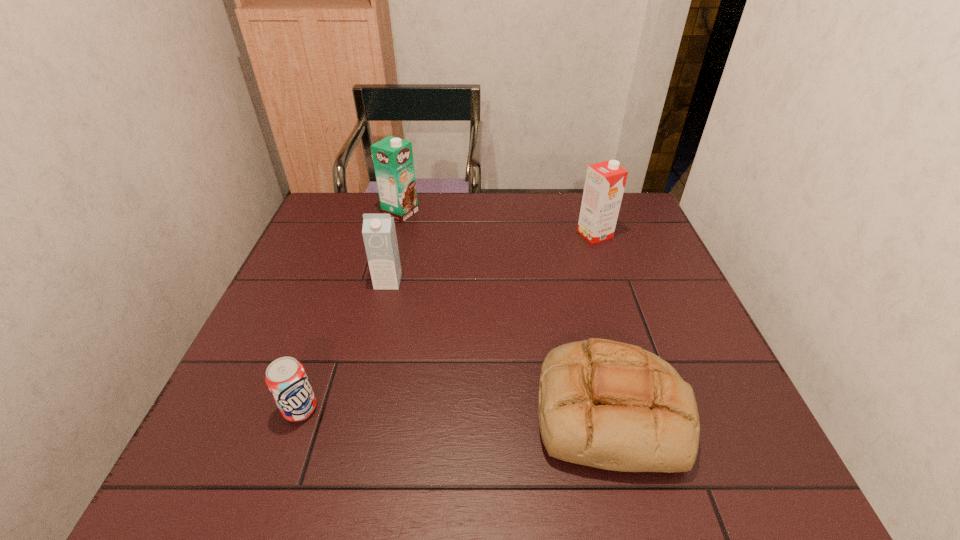
The image size is (960, 540). In the image, there is a desktop. Find the location of `vacant space at the right edge`. vacant space at the right edge is located at coordinates (642, 279).

Where is `vacant space at the far left corner`? Image resolution: width=960 pixels, height=540 pixels. vacant space at the far left corner is located at coordinates (319, 213).

Image resolution: width=960 pixels, height=540 pixels. Find the location of `vacant space at the near left corner`. vacant space at the near left corner is located at coordinates (227, 467).

This screenshot has height=540, width=960. I want to click on vacant area at the far right corner, so point(617,224).

This screenshot has height=540, width=960. I want to click on free space between the soda can and the bread, so click(x=456, y=410).

This screenshot has height=540, width=960. Identify the location of empty space between the bread and the second farthest object. (603, 322).

You are a GUI agent. You are given a task and a screenshot of the screen. Output one action in this format:
    pyautogui.click(x=<x>, y=<y>)
    Task: Click on the vacant space that's between the farthest carton and the leftmost object
    Image resolution: width=960 pixels, height=540 pixels.
    Given the screenshot: What is the action you would take?
    pyautogui.click(x=350, y=311)

You are a GUI agent. You are given a task and a screenshot of the screen. Output one action in this format:
    pyautogui.click(x=<x>, y=<y>)
    Task: Click on the free space between the soda can and the rightmost carton
    
    Given the screenshot: What is the action you would take?
    pyautogui.click(x=447, y=322)

Find the location of a particular element. This screenshot has height=540, width=960. blank region between the second nearest carton and the bread is located at coordinates (603, 322).

Where is `free spot between the leftmost object and the farthest object`? This screenshot has width=960, height=540. free spot between the leftmost object and the farthest object is located at coordinates (350, 311).